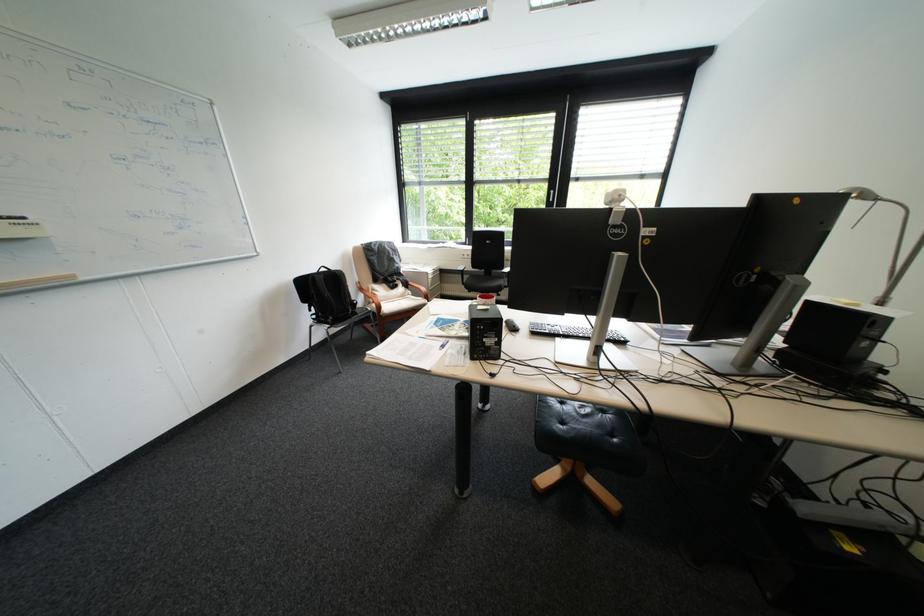
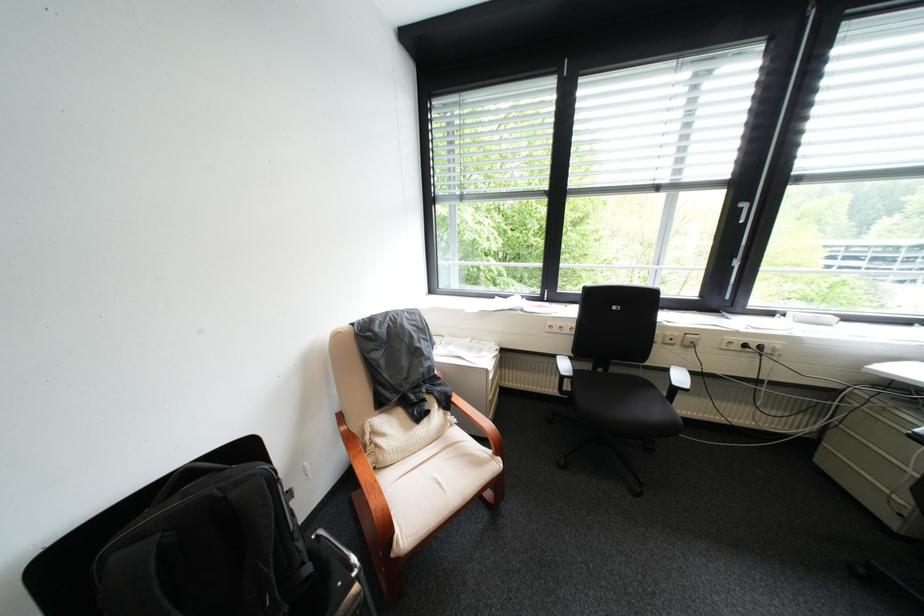
Question: Which direction would the cameraman need to move to produce the second image? Reply with the corresponding letter.

Choices:
 (A) Left
 (B) Right
 (C) Forward
 (D) Backward

Answer: (C)